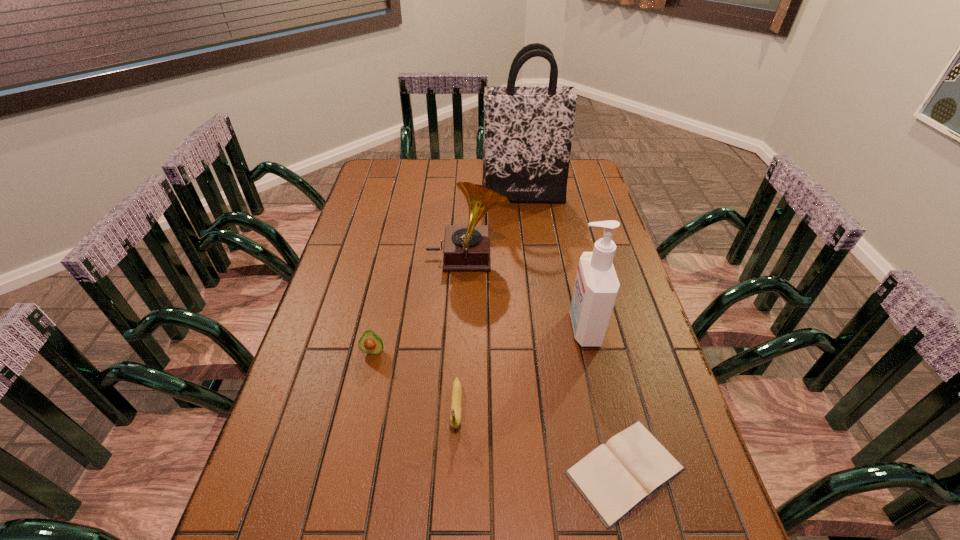
Locate an element on the screen. This screenshot has width=960, height=540. vacant space positioned on the front label of the fifth shortest object is located at coordinates (549, 328).

Locate an element on the screen. Image resolution: width=960 pixels, height=540 pixels. vacant space located 0.080m on the front label of the fifth shortest object is located at coordinates (539, 328).

Identify the location of vacant area situated from the horn of the phonograph record. (551, 258).

At what (x,y) coordinates should I click in order to perform the action: click on vacant area situated 0.130m on the cut side of the leftmost object. Please return your answer as a coordinate pair (x, y). The image size is (960, 540). Looking at the image, I should click on (x=362, y=402).

Find the location of a particular element. This screenshot has width=960, height=540. free space located at the stem of the banana is located at coordinates (452, 496).

At what (x,y) coordinates should I click in order to perform the action: click on free space located 0.050m on the left of the Bible. Please return your answer as a coordinate pair (x, y). Looking at the image, I should click on (540, 470).

Where is `object that is positioned at the far edge`? object that is positioned at the far edge is located at coordinates (528, 130).

I want to click on object that is at the left edge, so click(371, 343).

Where is `shopping bag present at the right edge`? The height and width of the screenshot is (540, 960). shopping bag present at the right edge is located at coordinates (528, 130).

Identify the location of cleansing agent that is at the right edge. (596, 287).